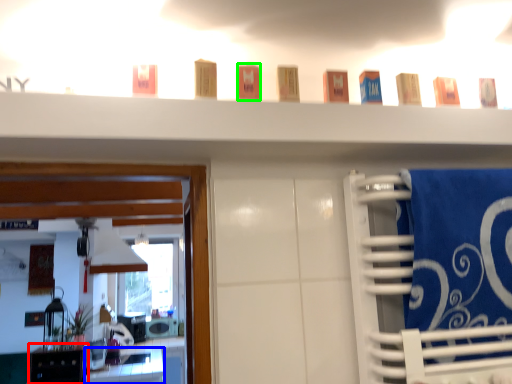
Question: Which object is positioned closest to cabinetry (highlighted by a red box)? Select from vanity (highlighted by a blue box) and toiletry (highlighted by a green box).

Choices:
 (A) vanity
 (B) toiletry

Answer: (A)